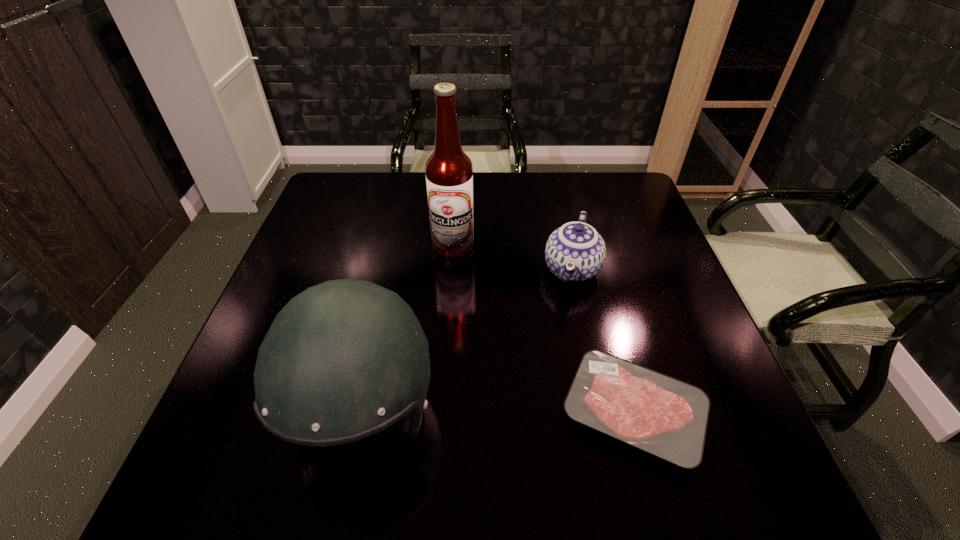
I want to click on free space located 0.190m at the spout of the chinaware, so (x=553, y=367).

The image size is (960, 540). I want to click on football helmet present at the near edge, so click(x=345, y=359).

The width and height of the screenshot is (960, 540). In order to click on steak located in the near edge section of the desktop in this screenshot , I will do `click(666, 417)`.

At what (x,y) coordinates should I click in order to perform the action: click on object that is at the left edge. Please return your answer as a coordinate pair (x, y). The height and width of the screenshot is (540, 960). Looking at the image, I should click on (345, 359).

The image size is (960, 540). I want to click on object located at the right edge, so click(666, 417).

The image size is (960, 540). What are the coordinates of `object positioned at the near left corner` in the screenshot? It's located at pos(345,359).

You are a GUI agent. You are given a task and a screenshot of the screen. Output one action in this format:
    pyautogui.click(x=<x>, y=<y>)
    Task: Click on the object present at the near right corner
    Image resolution: width=960 pixels, height=540 pixels.
    Given the screenshot: What is the action you would take?
    pyautogui.click(x=666, y=417)

Locate an element on the screen. Image resolution: width=960 pixels, height=540 pixels. free space at the far edge of the desktop is located at coordinates (400, 186).

This screenshot has width=960, height=540. In the image, there is a desktop. What are the coordinates of `free space at the left edge` in the screenshot? It's located at (328, 255).

I want to click on free region at the right edge of the desktop, so click(687, 334).